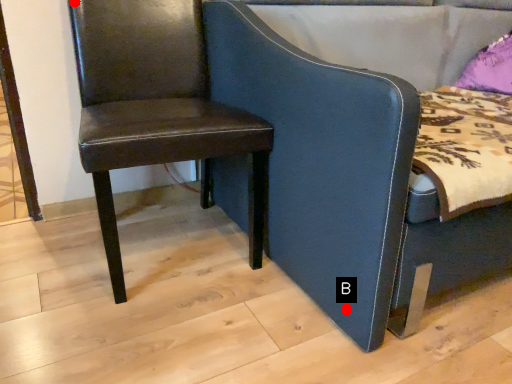
Question: Two points are circled on the image, labeled by A and B beside each circle. Which of the following is the closest to the observer?

Choices:
 (A) A is closer
 (B) B is closer

Answer: (B)